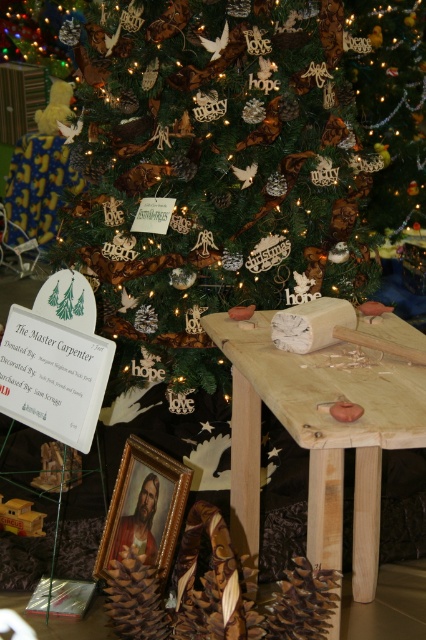
You are a carpenter working on a project and need to place a tool on the natural wood table at center. The tool requires 18 inches of clear space. Can you place it there without moving the brown matte pine cone at lower center?

The natural wood table at center is only 16.07 inches from the brown matte pine cone at lower center, which is less than the required 18 inches of clear space. Therefore, you cannot place the tool there without moving the pine cone.

You are an interior designer planning to place a decorative item between the green textured christmas tree at center and the brown matte pine cone at lower center. Considering their sizes, which object should you place closer to the smaller one to maintain balance?

The brown matte pine cone at lower center is smaller, so placing the decorative item closer to it would help balance the composition with the larger green textured christmas tree at center.

You are a carpenter who needs to move the natural wood table at center to the workbench. The mallet is on the workbench. Can you reach the mallet without moving the table?

The natural wood table at center is 94.02 centimeters away from the workbench. Since the distance is over 90 centimeters, you cannot reach the mallet without moving the table.